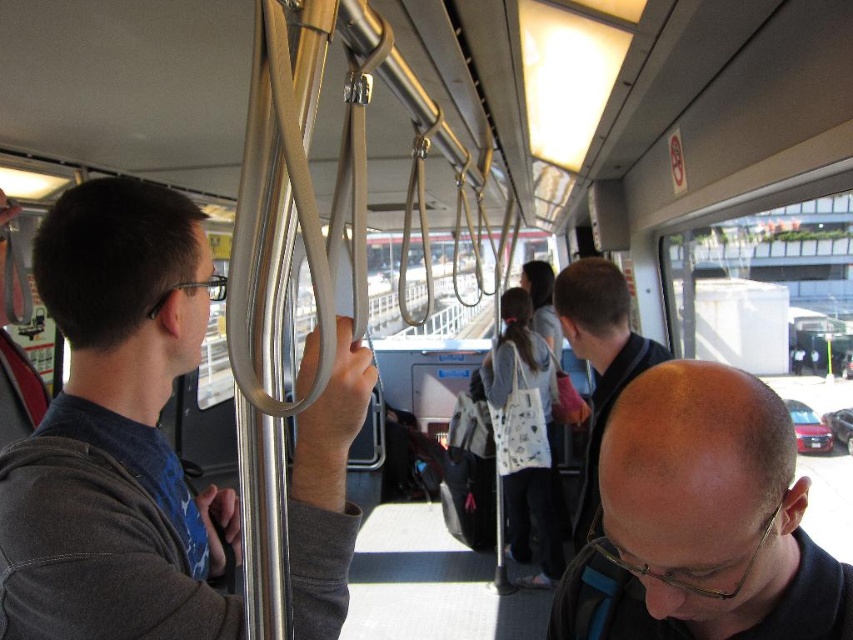
Question: Can you confirm if matte gray pole at left is wider than white fabric bag at center?

Choices:
 (A) no
 (B) yes

Answer: (B)

Question: Which point is closer to the camera?

Choices:
 (A) (527, 296)
 (B) (614, 394)
 (C) (140, 605)

Answer: (C)

Question: Which of the following is the farthest from the observer?

Choices:
 (A) bald head at lower right
 (B) white fabric bag at center
 (C) dark blue hoodie at center
 (D) matte gray pole at left

Answer: (B)

Question: Which object appears farthest from the camera in this image?

Choices:
 (A) bald head at lower right
 (B) matte gray pole at left

Answer: (B)

Question: Does matte gray pole at left have a lesser width compared to white fabric bag at center?

Choices:
 (A) yes
 (B) no

Answer: (B)

Question: In this image, where is matte gray pole at left located relative to white fabric bag at center?

Choices:
 (A) left
 (B) right

Answer: (A)